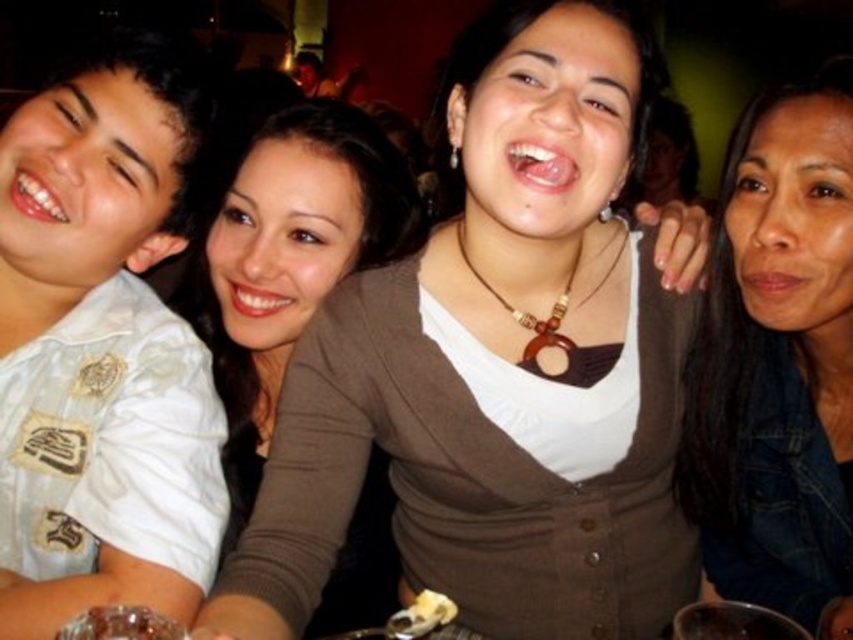
Who is taller, denim jacket at lower right or brown matte sweater at center?

brown matte sweater at center

This screenshot has height=640, width=853. In order to click on denim jacket at lower right in this screenshot , I will do pos(776,356).